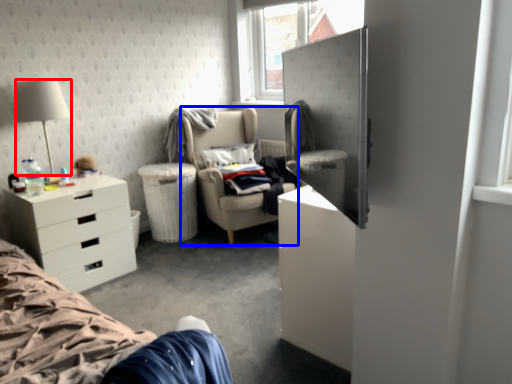
Question: Which of the following is the farthest to the observer, lamp (highlighted by a red box) or chair (highlighted by a blue box)?

Choices:
 (A) lamp
 (B) chair

Answer: (B)